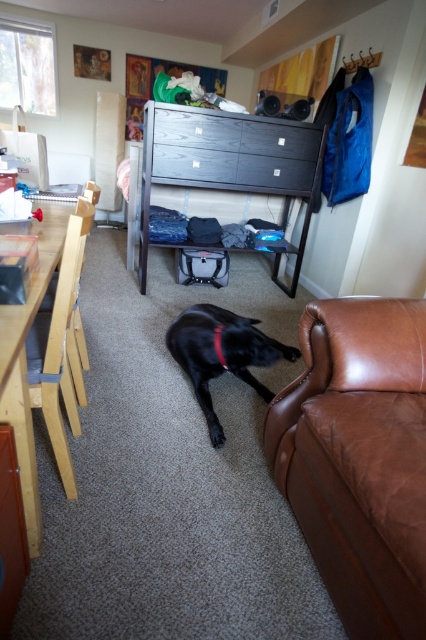
Question: Which of the following is the closest to the observer?

Choices:
 (A) matte black drawer at center
 (B) black wood dresser at center

Answer: (B)

Question: Among these objects, which one is farthest from the camera?

Choices:
 (A) matte black drawer at center
 (B) brown leather couch at lower right
 (C) light wood chair at left
 (D) wooden drawer at center

Answer: (D)

Question: Can you confirm if black wood dresser at center is smaller than wooden drawer at center?

Choices:
 (A) no
 (B) yes

Answer: (A)

Question: Which object appears closest to the camera in this image?

Choices:
 (A) black leather dog at lower center
 (B) wooden drawer at center

Answer: (A)

Question: Is black leather dog at lower center to the right of wooden drawer at center from the viewer's perspective?

Choices:
 (A) no
 (B) yes

Answer: (B)

Question: Does black wood dresser at center have a larger size compared to black leather dog at lower center?

Choices:
 (A) no
 (B) yes

Answer: (B)